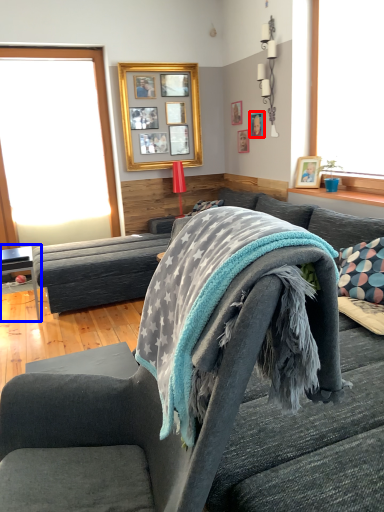
Question: Which object appears closest to the camera in this image, picture frame (highlighted by a red box) or table (highlighted by a blue box)?

Choices:
 (A) picture frame
 (B) table

Answer: (B)